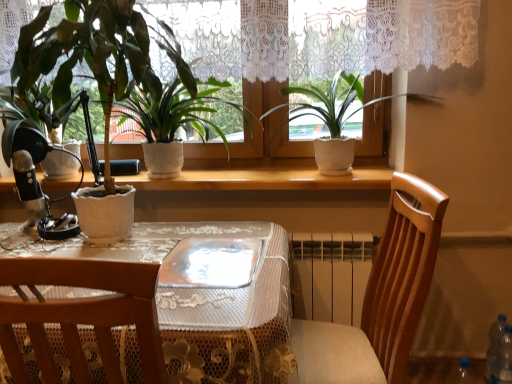
Question: Should I look upward or downward to see wooden chair at center?

Choices:
 (A) down
 (B) up

Answer: (A)

Question: Is wooden chair at center at the back of wooden table at center?

Choices:
 (A) no
 (B) yes

Answer: (A)

Question: Could wooden chair at center be considered to be inside wooden table at center?

Choices:
 (A) yes
 (B) no

Answer: (A)

Question: Would you consider wooden table at center to be distant from wooden chair at center?

Choices:
 (A) yes
 (B) no

Answer: (B)

Question: Is wooden table at center positioned beyond the bounds of wooden chair at center?

Choices:
 (A) no
 (B) yes

Answer: (B)

Question: Is wooden table at center bigger than wooden chair at center?

Choices:
 (A) yes
 (B) no

Answer: (A)

Question: Are wooden table at center and wooden chair at center making contact?

Choices:
 (A) yes
 (B) no

Answer: (B)

Question: From the image's perspective, is matte white pot at left, the 1th houseplant in the left-to-right sequence, below white textured pot at center, which is counted as the 2th houseplant, starting from the right?

Choices:
 (A) no
 (B) yes

Answer: (B)

Question: Is matte white pot at left, the 1th houseplant in the left-to-right sequence, smaller than white textured pot at center, positioned as the 2th houseplant in left-to-right order?

Choices:
 (A) no
 (B) yes

Answer: (A)

Question: Would you say matte white pot at left, which is the third houseplant in right-to-left order, is a long distance from white textured pot at center, which is counted as the 2th houseplant, starting from the right?

Choices:
 (A) yes
 (B) no

Answer: (B)

Question: Is matte white pot at left, which is the third houseplant in right-to-left order, taller than white textured pot at center, which is counted as the 2th houseplant, starting from the right?

Choices:
 (A) yes
 (B) no

Answer: (A)

Question: Is matte white pot at left, the 1th houseplant in the left-to-right sequence, outside white textured pot at center, which is counted as the 2th houseplant, starting from the right?

Choices:
 (A) no
 (B) yes

Answer: (B)

Question: Is white textured pot at center, positioned as the 2th houseplant in left-to-right order, completely or partially inside matte white pot at left, the 1th houseplant in the left-to-right sequence?

Choices:
 (A) no
 (B) yes

Answer: (A)

Question: Could you tell me if transparent plastic bottle at lower right is facing transparent glass plate at center?

Choices:
 (A) yes
 (B) no

Answer: (B)